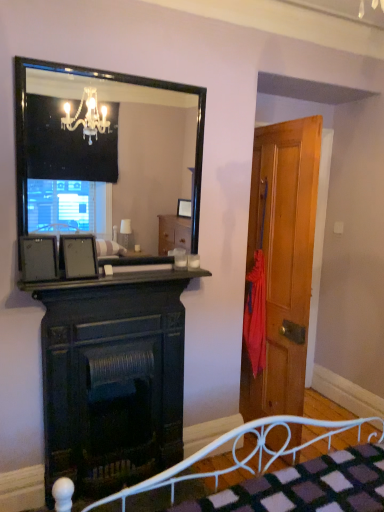
Where is `free point below black glossy mirror at upper center (from a real-world perspective)`? The image size is (384, 512). free point below black glossy mirror at upper center (from a real-world perspective) is located at coordinates (139, 268).